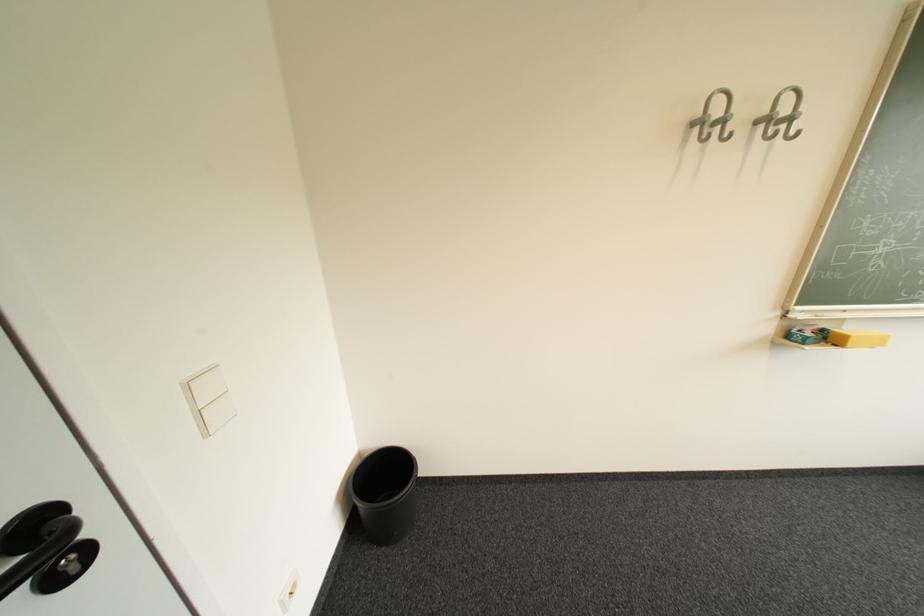
Which object does [385,493] point to?

This point indicates the black trash can.